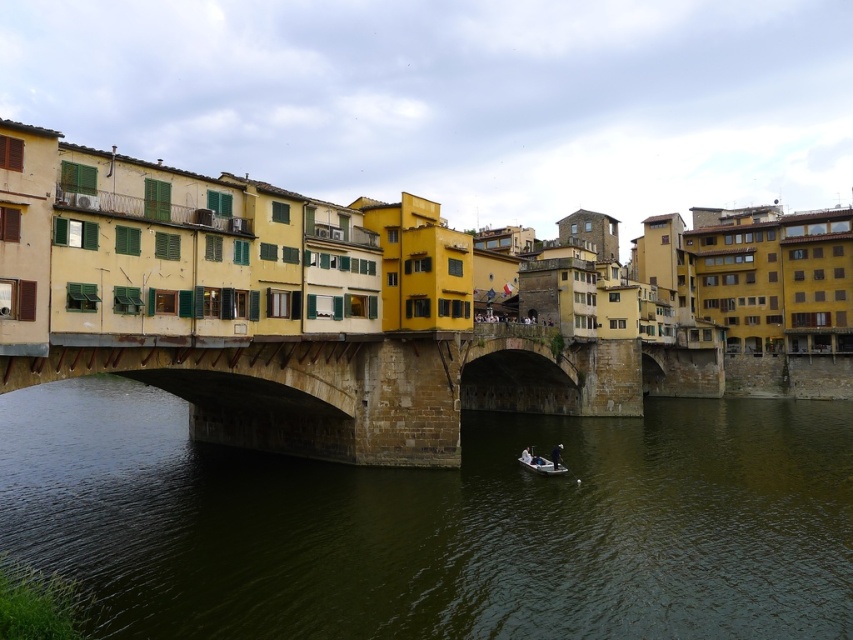
How distant is greenish-brown water at center from white plastic boat at lower center?

greenish-brown water at center and white plastic boat at lower center are 21.11 meters apart from each other.

Is greenish-brown water at center smaller than white plastic boat at lower center?

Incorrect, greenish-brown water at center is not smaller in size than white plastic boat at lower center.

What do you see at coordinates (439, 524) in the screenshot?
I see `greenish-brown water at center` at bounding box center [439, 524].

You are a GUI agent. You are given a task and a screenshot of the screen. Output one action in this format:
    pyautogui.click(x=<x>, y=<y>)
    Task: Click on the greenish-brown water at center
    This screenshot has width=853, height=640.
    Given the screenshot: What is the action you would take?
    pyautogui.click(x=439, y=524)

Does greenish-brown water at center have a greater width compared to stone bridge at center?

Correct, the width of greenish-brown water at center exceeds that of stone bridge at center.

Is point (375, 502) in front of point (125, 360)?

No, it is not.

Image resolution: width=853 pixels, height=640 pixels. What are the coordinates of `greenish-brown water at center` in the screenshot? It's located at (439, 524).

Between stone bridge at center and white plastic boat at lower center, which one has less height?

white plastic boat at lower center is shorter.

Does point (712, 364) come in front of point (524, 456)?

No, it is behind (524, 456).

Is point (527, 364) in front of point (523, 465)?

That is False.

This screenshot has width=853, height=640. I want to click on stone bridge at center, so click(x=386, y=385).